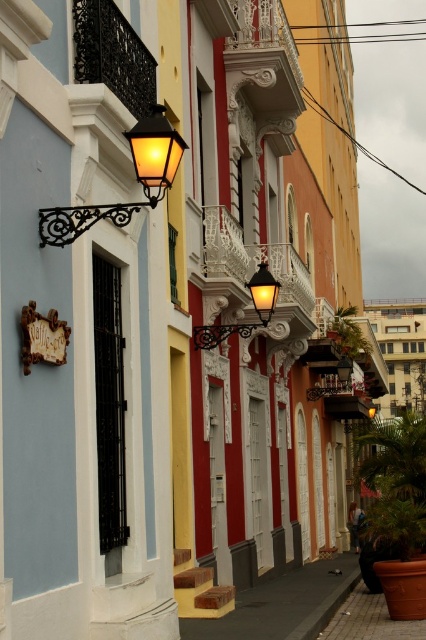
Is matte black lantern at upper left shorter than matte black lantern at center?

Correct, matte black lantern at upper left is not as tall as matte black lantern at center.

Can you confirm if matte black lantern at upper left is positioned to the right of matte black lantern at center?

No, matte black lantern at upper left is not to the right of matte black lantern at center.

Between point (75, 221) and point (247, 337), which one is positioned behind?

The point (247, 337) is behind.

Identify the location of matte black lantern at upper left. (135, 177).